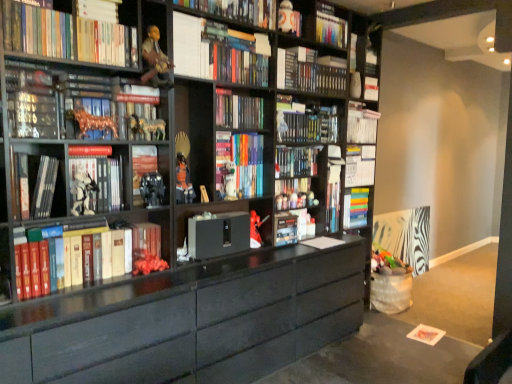
Question: Does white glossy book at upper left, which is the twelfth book in bottom-to-top order, have a greater height compared to hardcover book at upper center, positioned as the eleventh book in bottom-to-top order?

Choices:
 (A) yes
 (B) no

Answer: (B)

Question: Considering the relative sizes of white glossy book at upper left, which is the twelfth book in bottom-to-top order, and hardcover book at upper center, positioned as the eleventh book in bottom-to-top order, in the image provided, is white glossy book at upper left, which is the twelfth book in bottom-to-top order, bigger than hardcover book at upper center, positioned as the eleventh book in bottom-to-top order,?

Choices:
 (A) no
 (B) yes

Answer: (A)

Question: Can you confirm if white glossy book at upper left, which is the third book in top-to-bottom order, is smaller than hardcover book at upper center, positioned as the eleventh book in bottom-to-top order?

Choices:
 (A) no
 (B) yes

Answer: (B)

Question: Can you confirm if white glossy book at upper left, which is the twelfth book in bottom-to-top order, is positioned to the left of hardcover book at upper center, placed as the fourth book when sorted from top to bottom?

Choices:
 (A) yes
 (B) no

Answer: (A)

Question: Is white glossy book at upper left, which is the third book in top-to-bottom order, far away from hardcover book at upper center, positioned as the eleventh book in bottom-to-top order?

Choices:
 (A) no
 (B) yes

Answer: (B)

Question: Considering the positions of point (74, 170) and point (360, 221), is point (74, 170) closer or farther from the camera than point (360, 221)?

Choices:
 (A) farther
 (B) closer

Answer: (B)

Question: Considering their positions, is white matte figure at left, the fifth book ordered from the bottom, located in front of or behind multicolored hardcover books at center, which ranks as the thirteenth book in top-to-bottom order?

Choices:
 (A) behind
 (B) front

Answer: (B)

Question: Is white matte figure at left, which is the 10th book from top to bottom, bigger or smaller than multicolored hardcover books at center, which ranks as the thirteenth book in top-to-bottom order?

Choices:
 (A) small
 (B) big

Answer: (A)

Question: From their relative heights in the image, would you say white matte figure at left, which is the 10th book from top to bottom, is taller or shorter than multicolored hardcover books at center, placed as the 2th book when sorted from bottom to top?

Choices:
 (A) tall
 (B) short

Answer: (B)

Question: Looking at the image, does matte black bookshelf at center, the 9th book positioned from the top, seem bigger or smaller compared to hardcover books at left, the fourteenth book positioned from the top?

Choices:
 (A) big
 (B) small

Answer: (B)

Question: In terms of height, does matte black bookshelf at center, the 9th book positioned from the top, look taller or shorter compared to hardcover books at left, the fourteenth book positioned from the top?

Choices:
 (A) short
 (B) tall

Answer: (A)

Question: Is matte black bookshelf at center, the 9th book positioned from the top, spatially inside hardcover books at left, the first book from the bottom, or outside of it?

Choices:
 (A) inside
 (B) outside

Answer: (B)

Question: Is point pos(295,155) closer or farther from the camera than point pos(91,279)?

Choices:
 (A) closer
 (B) farther

Answer: (B)

Question: Does point (296, 31) appear closer or farther from the camera than point (263, 215)?

Choices:
 (A) farther
 (B) closer

Answer: (A)

Question: Is multicolored bookshelf at upper center in front of or behind matte black cabinet at center in the image?

Choices:
 (A) behind
 (B) front

Answer: (A)